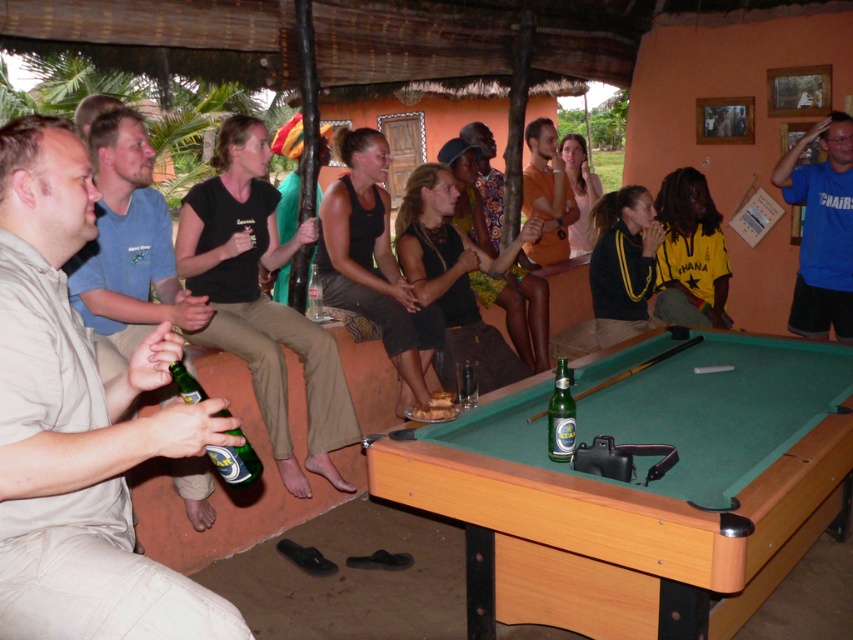
Can you confirm if green matte beer bottle at lower left is positioned above green glass bottle at center?

Yes, green matte beer bottle at lower left is above green glass bottle at center.

Does green matte beer bottle at lower left appear on the left side of green glass bottle at center?

Indeed, green matte beer bottle at lower left is positioned on the left side of green glass bottle at center.

The height and width of the screenshot is (640, 853). Describe the element at coordinates (235, 464) in the screenshot. I see `green matte beer bottle at lower left` at that location.

At what (x,y) coordinates should I click in order to perform the action: click on green matte beer bottle at lower left. Please return your answer as a coordinate pair (x, y). This screenshot has height=640, width=853. Looking at the image, I should click on (235, 464).

Who is positioned more to the left, beige cotton shirt at left or blue t-shirt at upper right?

beige cotton shirt at left is more to the left.

Is beige cotton shirt at left further to the viewer compared to blue t-shirt at upper right?

No, beige cotton shirt at left is in front of blue t-shirt at upper right.

Which is behind, point (129, 458) or point (837, 160)?

Point (837, 160)

Identify the location of beige cotton shirt at left. (79, 424).

Is green felt pool table at center taller than beige cotton shirt at left?

No.

Is green felt pool table at center closer to camera compared to beige cotton shirt at left?

No, it is behind beige cotton shirt at left.

What do you see at coordinates (640, 490) in the screenshot? The width and height of the screenshot is (853, 640). I see `green felt pool table at center` at bounding box center [640, 490].

Where is `green felt pool table at center`? The height and width of the screenshot is (640, 853). green felt pool table at center is located at coordinates (640, 490).